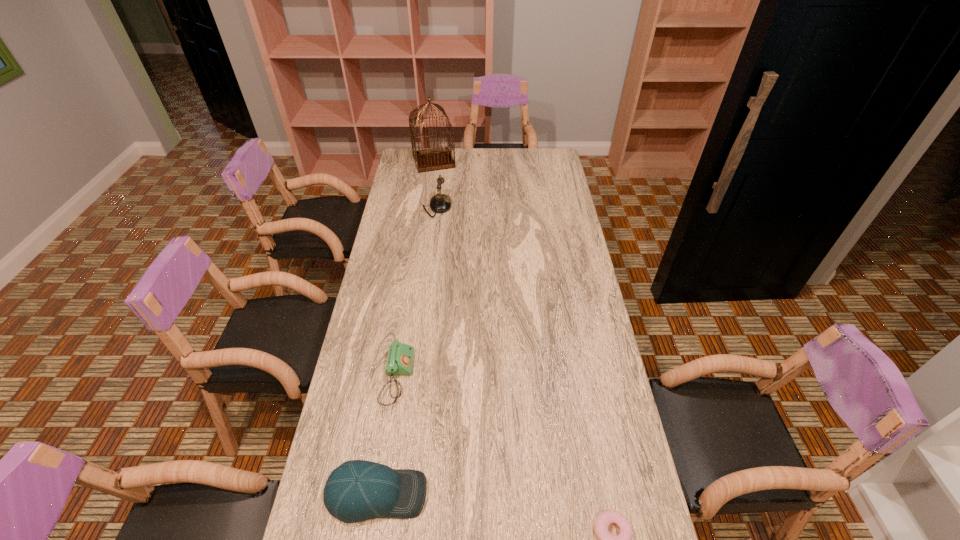
The image size is (960, 540). What are the coordinates of `free space between the third nearest object and the taller telephone` in the screenshot? It's located at (417, 292).

Image resolution: width=960 pixels, height=540 pixels. What are the coordinates of `blank region between the tallest object and the baseball cap` in the screenshot? It's located at (405, 327).

This screenshot has height=540, width=960. What are the coordinates of `empty space between the tallest object and the fourth shortest object` in the screenshot? It's located at (435, 184).

This screenshot has height=540, width=960. I want to click on vacant area that lies between the second shortest object and the baseball cap, so click(x=387, y=435).

At what (x,y) coordinates should I click in order to perform the action: click on the fourth closest object relative to the shortest object. Please return your answer as a coordinate pair (x, y). This screenshot has height=540, width=960. Looking at the image, I should click on (433, 159).

The image size is (960, 540). In order to click on the closest object to the baseball cap in this screenshot , I will do `click(400, 356)`.

At what (x,y) coordinates should I click in order to perform the action: click on vacant space that satisfies the following two spatial constraints: 1. on the dial of the taller telephone; 2. on the front side of the baseball cap. Please return your answer as a coordinate pair (x, y). The image size is (960, 540). Looking at the image, I should click on (403, 494).

Locate an element on the screen. The width and height of the screenshot is (960, 540). vacant space that satisfies the following two spatial constraints: 1. on the dial of the shorter telephone; 2. on the front side of the baseball cap is located at coordinates [379, 494].